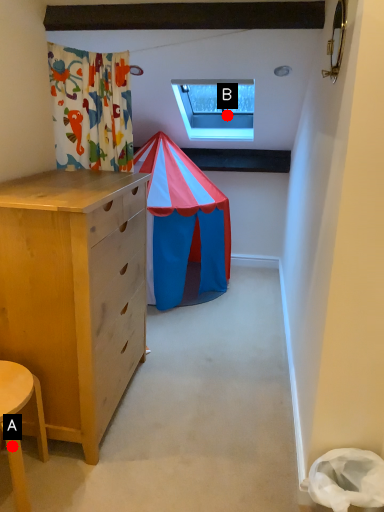
Question: Two points are circled on the image, labeled by A and B beside each circle. Which point appears farthest from the camera in this image?

Choices:
 (A) A is further
 (B) B is further

Answer: (B)